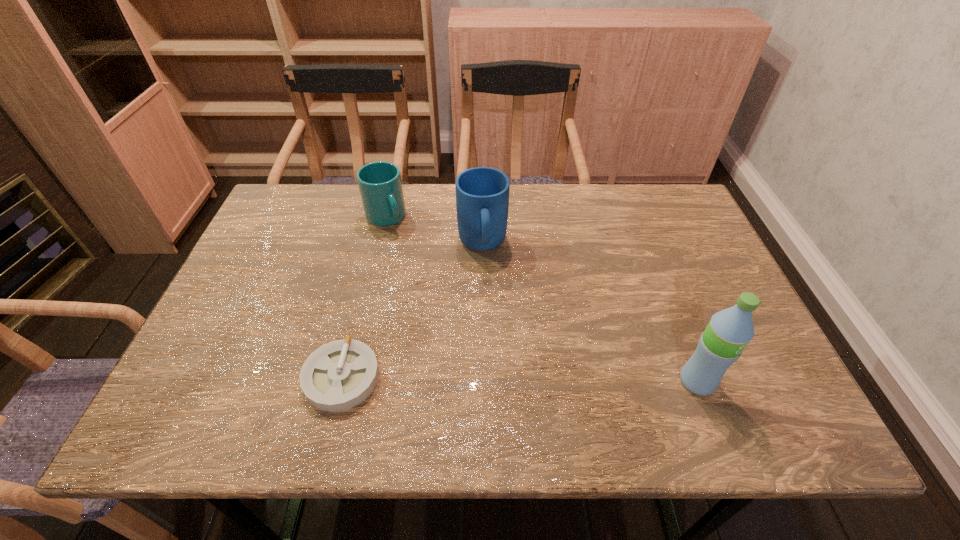
This screenshot has width=960, height=540. In order to click on blank area located on the handle side of the cup in this screenshot , I will do `click(410, 254)`.

Locate an element on the screen. vacant space positioned 0.290m on the handle side of the cup is located at coordinates (442, 295).

Identify the location of blank space located 0.390m on the handle side of the cup. The image size is (960, 540). (463, 322).

The image size is (960, 540). I want to click on mug that is at the far edge, so click(x=482, y=193).

Where is `cup present at the far edge`? cup present at the far edge is located at coordinates (380, 185).

At what (x,y) coordinates should I click in order to perform the action: click on ashtray located in the near edge section of the desktop. Please return your answer as a coordinate pair (x, y). Looking at the image, I should click on (339, 375).

Identify the location of water bottle present at the near edge. The width and height of the screenshot is (960, 540). (729, 331).

Find the location of `object located at the right edge`. object located at the right edge is located at coordinates (729, 331).

Identify the location of object that is positioned at the near right corner. This screenshot has width=960, height=540. (729, 331).

This screenshot has width=960, height=540. In the image, there is a desktop. What are the coordinates of `vacant space at the far edge` in the screenshot? It's located at (557, 225).